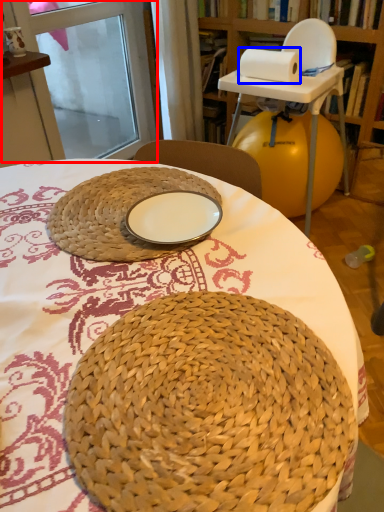
Question: Which object is further to the camera taking this photo, screen door (highlighted by a red box) or paper towel (highlighted by a blue box)?

Choices:
 (A) screen door
 (B) paper towel

Answer: (A)